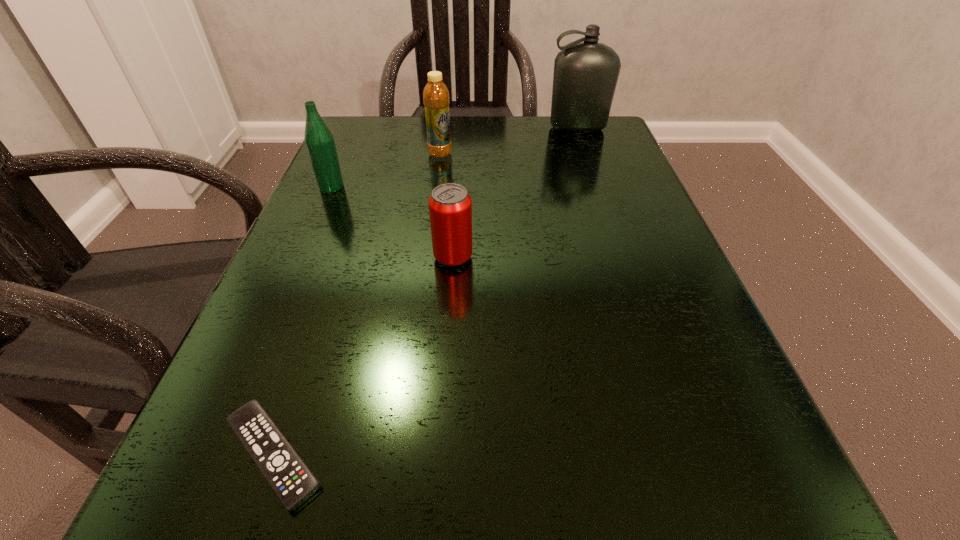
The width and height of the screenshot is (960, 540). I want to click on blank area located on the left of the farthest bottle, so click(x=427, y=129).

At what (x,y) coordinates should I click in order to perform the action: click on vacant space located 0.070m on the back of the second farthest bottle. Please return your answer as a coordinate pair (x, y). Looking at the image, I should click on (443, 134).

Locate an element on the screen. This screenshot has width=960, height=540. vacant space located on the front of the nearest bottle is located at coordinates (255, 361).

Locate an element on the screen. blank space located 0.180m on the front of the fourth farthest object is located at coordinates (446, 366).

Image resolution: width=960 pixels, height=540 pixels. Identify the location of free location located on the back of the nearest object. (330, 287).

Where is `object located at the near edge`? object located at the near edge is located at coordinates (290, 478).

You are a GUI agent. You are given a task and a screenshot of the screen. Output one action in this format:
    pyautogui.click(x=<x>, y=<y>)
    Task: Click on the bottle that is at the left edge
    The width and height of the screenshot is (960, 540).
    Given the screenshot: What is the action you would take?
    pyautogui.click(x=319, y=141)

Find the location of a particular element. The height and width of the screenshot is (540, 960). remote control that is at the left edge is located at coordinates (290, 478).

You are a GUI agent. You are given a task and a screenshot of the screen. Output one action in this format:
    pyautogui.click(x=<x>, y=<y>)
    Task: Click on the object present at the right edge
    
    Given the screenshot: What is the action you would take?
    pyautogui.click(x=585, y=76)

Where is `object located in the near left corner section of the desktop`? object located in the near left corner section of the desktop is located at coordinates (290, 478).